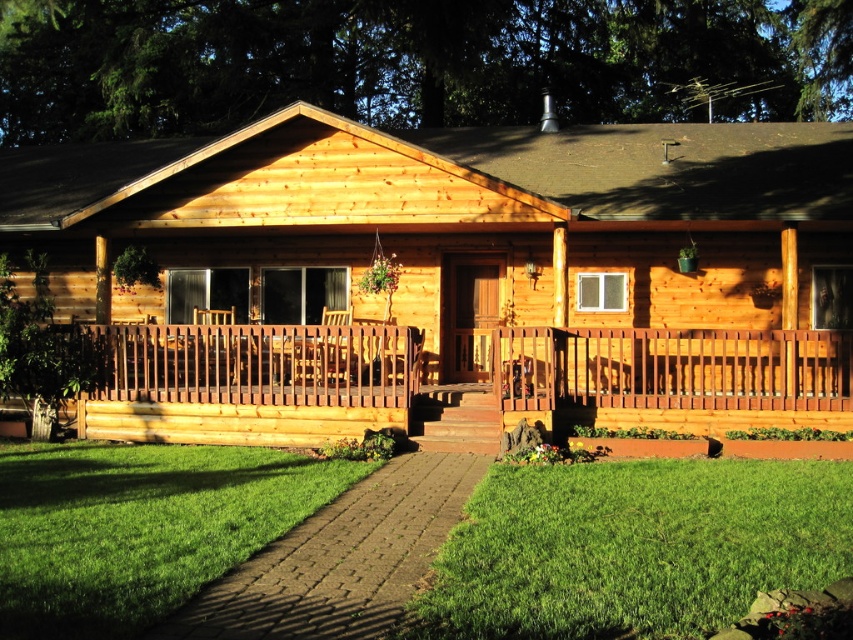
You are standing at the camera position and want to reach the point marked as point [117,344]. If your walking speed is 3 feet per second, how many seconds will it take you to reach there?

The distance between you and point [117,344] is 45.10 feet. At a speed of 3 feet per second, it will take 45.10 divided by 3, which is approximately 15.03 seconds to reach the point.

You are standing in front of the wooden cabin and notice two points marked on the porch. The first point is at coordinate point (x=524, y=301) and the second is at point (x=614, y=74). Which of these two points is closer to you?

Point (x=524, y=301) is closer to the viewer than point (x=614, y=74).

You are standing at the edge of a forest path and see the natural wood cabin at center and the green leafy tree at upper center. Which object is closer to your left side?

The natural wood cabin at center is to the left of green leafy tree at upper center, so the natural wood cabin at center is closer to your left side.